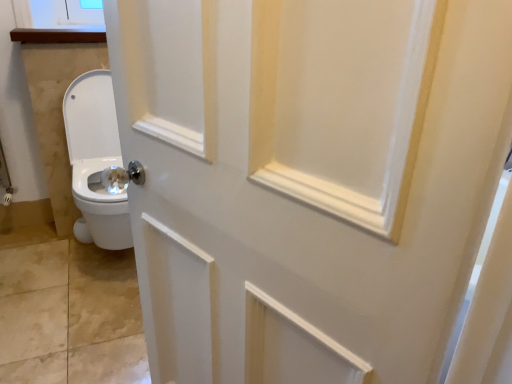
The image size is (512, 384). Describe the element at coordinates (60, 35) in the screenshot. I see `wooden at upper left` at that location.

Measure the distance between wooden at upper left and camera.

A distance of 1.84 meters exists between wooden at upper left and camera.

Find the location of a particular element. wooden at upper left is located at coordinates (60, 35).

What is the approximate height of wooden at upper left?

wooden at upper left is 2.29 inches tall.

Locate an element on the screen. The width and height of the screenshot is (512, 384). wooden at upper left is located at coordinates (60, 35).